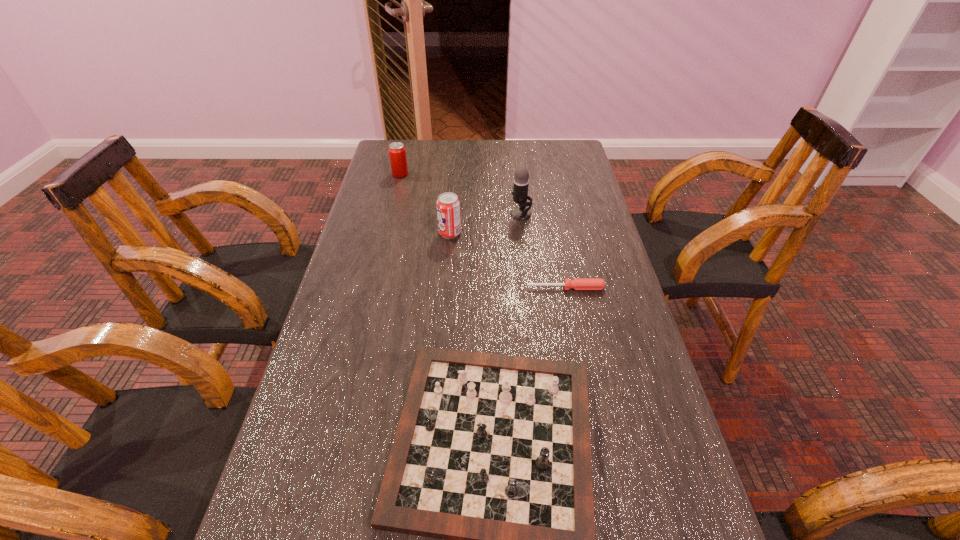
Locate an element on the screen. The height and width of the screenshot is (540, 960). vacant space located on the back of the shortest object is located at coordinates (551, 216).

Identify the location of object that is at the far edge. (397, 153).

Locate an element on the screen. This screenshot has height=540, width=960. object at the left edge is located at coordinates (397, 153).

Locate an element on the screen. Image resolution: width=960 pixels, height=540 pixels. object located at the right edge is located at coordinates (578, 283).

You are a GUI agent. You are given a task and a screenshot of the screen. Output one action in this format:
    pyautogui.click(x=<x>, y=<y>)
    Task: Click on the object at the far left corner
    The image size is (960, 540).
    Given the screenshot: What is the action you would take?
    pyautogui.click(x=397, y=153)

Locate an element on the screen. free region at the far edge of the desktop is located at coordinates (501, 172).

In the image, there is a desktop. Where is `vacant space at the left edge`? vacant space at the left edge is located at coordinates (311, 355).

I want to click on blank space at the right edge of the desktop, so click(x=596, y=246).

Locate an element on the screen. free space at the far left corner is located at coordinates [416, 142].

You are a GUI agent. You are given a task and a screenshot of the screen. Output one action in this format:
    pyautogui.click(x=<x>, y=<y>)
    Task: Click on the free space at the far right corner
    The image size is (960, 540).
    Given the screenshot: What is the action you would take?
    541,148